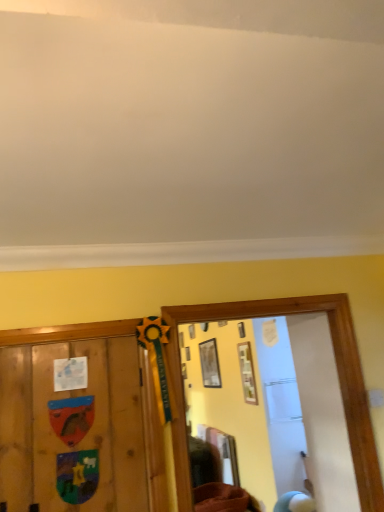
Question: From the image's perspective, is matte wooden picture frame at upper center, which is the 2th picture frame from back to front, on top of brown fabric at lower center?

Choices:
 (A) yes
 (B) no

Answer: (A)

Question: Is matte wooden picture frame at upper center, acting as the 2th picture frame starting from the front, closer to the viewer compared to brown fabric at lower center?

Choices:
 (A) no
 (B) yes

Answer: (A)

Question: Is matte wooden picture frame at upper center, acting as the 2th picture frame starting from the front, looking in the opposite direction of brown fabric at lower center?

Choices:
 (A) yes
 (B) no

Answer: (B)

Question: Is matte wooden picture frame at upper center, acting as the 2th picture frame starting from the front, bigger than brown fabric at lower center?

Choices:
 (A) yes
 (B) no

Answer: (B)

Question: From a real-world perspective, does matte wooden picture frame at upper center, which is the second picture frame in right-to-left order, stand above brown fabric at lower center?

Choices:
 (A) no
 (B) yes

Answer: (B)

Question: Would you say matte white picture frame at center, the third picture frame from the left, is to the left or to the right of brown fabric at lower center in the picture?

Choices:
 (A) left
 (B) right

Answer: (B)

Question: In terms of width, does matte white picture frame at center, the 3th picture frame in the back-to-front sequence, look wider or thinner when compared to brown fabric at lower center?

Choices:
 (A) wide
 (B) thin

Answer: (B)

Question: Considering their positions, is matte white picture frame at center, the 3th picture frame in the back-to-front sequence, located in front of or behind brown fabric at lower center?

Choices:
 (A) behind
 (B) front

Answer: (A)

Question: From the image's perspective, relative to brown fabric at lower center, is matte white picture frame at center, the 3th picture frame in the back-to-front sequence, above or below?

Choices:
 (A) below
 (B) above

Answer: (B)

Question: Visually, is wooden picture frame at upper center, positioned as the 3th picture frame in front-to-back order, positioned to the left or to the right of matte wooden picture frame at upper center, positioned as the second picture frame in left-to-right order?

Choices:
 (A) right
 (B) left

Answer: (B)

Question: Considering the positions of point (210, 377) and point (243, 328), is point (210, 377) closer or farther from the camera than point (243, 328)?

Choices:
 (A) farther
 (B) closer

Answer: (A)

Question: Is wooden picture frame at upper center, which appears as the 1th picture frame when viewed from the left, inside the boundaries of matte wooden picture frame at upper center, which is the 2th picture frame from back to front, or outside?

Choices:
 (A) inside
 (B) outside

Answer: (B)

Question: Looking at the image, does wooden picture frame at upper center, positioned as the 3th picture frame in front-to-back order, seem bigger or smaller compared to matte wooden picture frame at upper center, which is the second picture frame in right-to-left order?

Choices:
 (A) big
 (B) small

Answer: (A)

Question: Is brown fabric at lower center in front of or behind wooden picture frame at upper center, which appears as the 1th picture frame when viewed from the left, in the image?

Choices:
 (A) front
 (B) behind

Answer: (A)

Question: Is brown fabric at lower center bigger or smaller than wooden picture frame at upper center, which is counted as the 1th picture frame, starting from the back?

Choices:
 (A) small
 (B) big

Answer: (B)